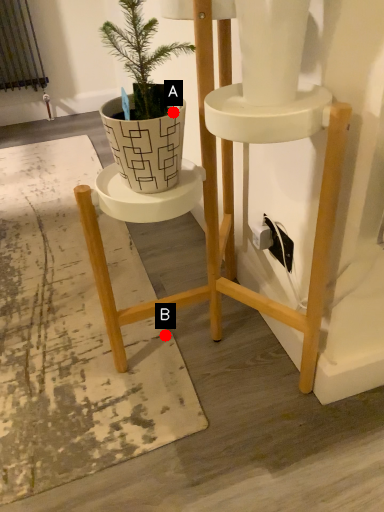
Question: Two points are circled on the image, labeled by A and B beside each circle. Which point is further to the camera?

Choices:
 (A) A is further
 (B) B is further

Answer: (B)